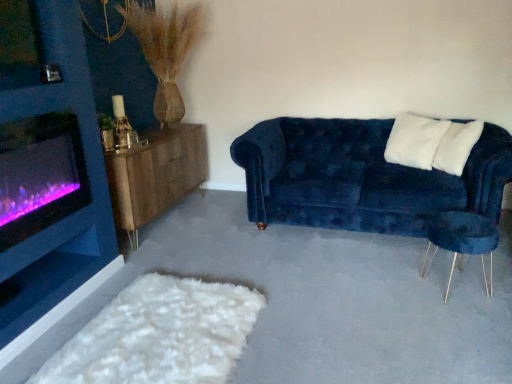
Where is `vacant area that lies in front of velvet blue armchair at right`? The height and width of the screenshot is (384, 512). vacant area that lies in front of velvet blue armchair at right is located at coordinates (466, 314).